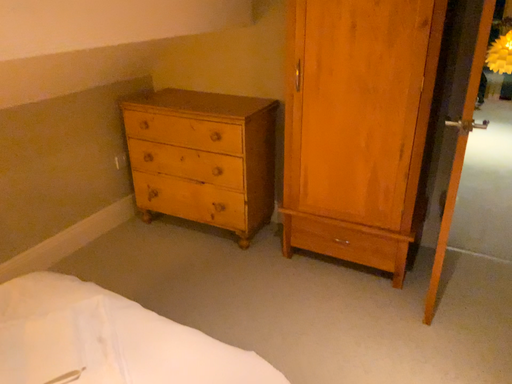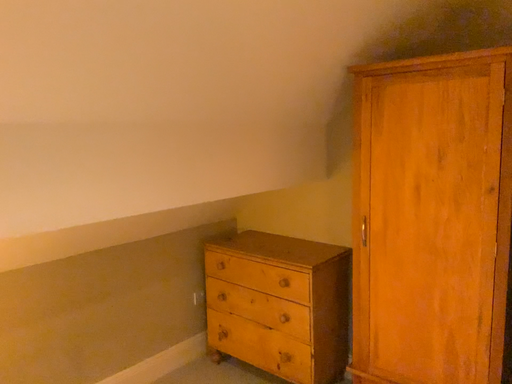
Question: Which way did the camera rotate in the video?

Choices:
 (A) rotated left
 (B) rotated right

Answer: (A)